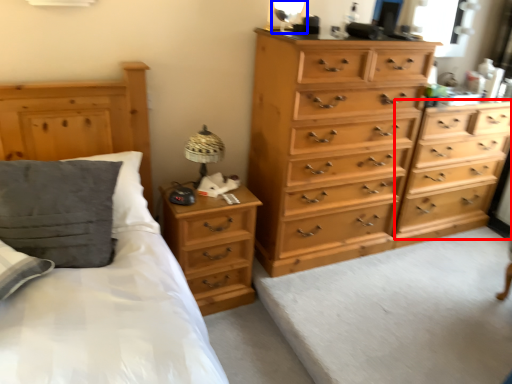
Question: Which of the following is the closest to the observer, chest of drawers (highlighted by a red box) or table lamp (highlighted by a blue box)?

Choices:
 (A) chest of drawers
 (B) table lamp

Answer: (B)